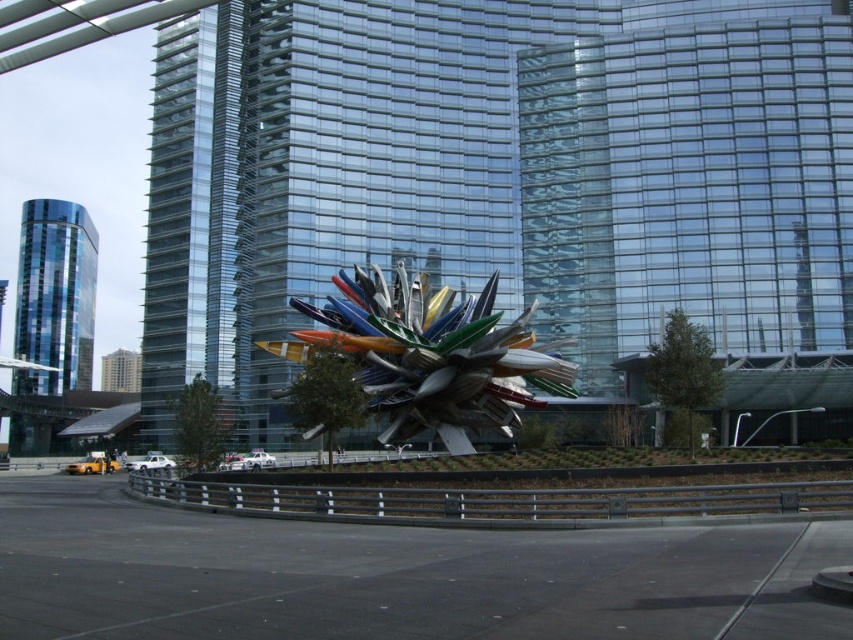
Question: Is metallic multi-colored blades at center closer to the viewer compared to blue glass tower at left?

Choices:
 (A) yes
 (B) no

Answer: (A)

Question: Can you confirm if metallic multi-colored blades at center is wider than blue glass tower at left?

Choices:
 (A) yes
 (B) no

Answer: (B)

Question: Is transparent glass tower at center smaller than blue glass tower at left?

Choices:
 (A) no
 (B) yes

Answer: (A)

Question: Which point is closer to the camera?

Choices:
 (A) blue glass tower at left
 (B) metallic multi-colored blades at center
 (C) transparent glass tower at center

Answer: (B)

Question: Which is farther from the metallic multi-colored blades at center?

Choices:
 (A) transparent glass tower at center
 (B) blue glass tower at left

Answer: (B)

Question: Among these points, which one is nearest to the camera?

Choices:
 (A) (555, 19)
 (B) (451, 376)

Answer: (B)